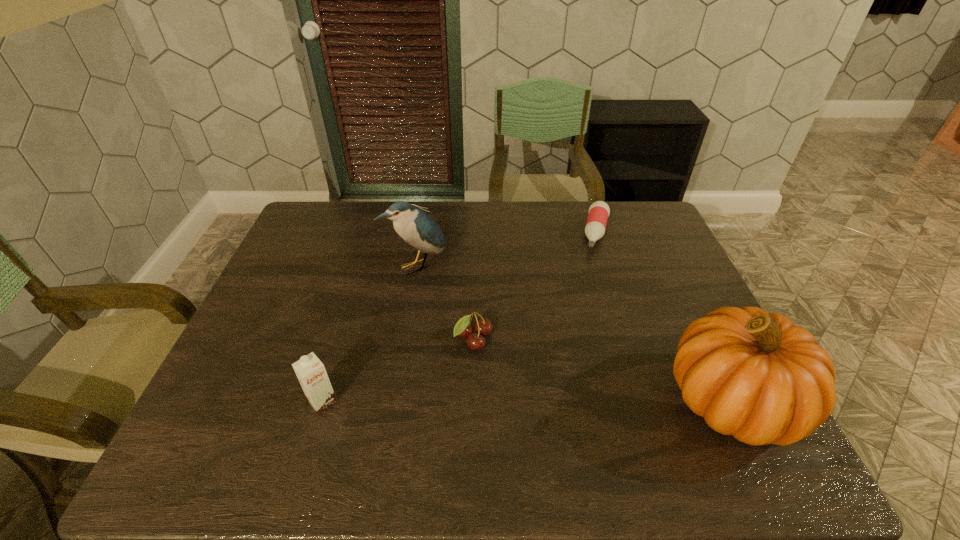
Where is `vacant spot on the desktop that is between the chocolate milk and the pumpkin and is positioned with the cap open on the bottle`? The width and height of the screenshot is (960, 540). vacant spot on the desktop that is between the chocolate milk and the pumpkin and is positioned with the cap open on the bottle is located at coordinates (559, 401).

Locate an element on the screen. This screenshot has width=960, height=540. vacant space on the desktop that is between the chocolate milk and the pumpkin and is positioned at the tip of the second object from left to right's beak is located at coordinates (538, 401).

Locate an element on the screen. vacant spot on the desktop that is between the third tallest object and the pumpkin and is positioned on the leaves of the third object from right to left is located at coordinates (538, 401).